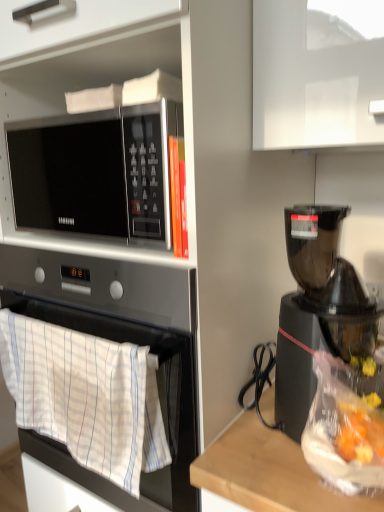
Question: Is black plastic coffee maker at right bigger than white cotton towel at lower left?

Choices:
 (A) yes
 (B) no

Answer: (A)

Question: Can you confirm if black plastic coffee maker at right is shorter than white cotton towel at lower left?

Choices:
 (A) no
 (B) yes

Answer: (A)

Question: Does black plastic coffee maker at right have a lesser width compared to white cotton towel at lower left?

Choices:
 (A) yes
 (B) no

Answer: (B)

Question: From the image's perspective, would you say black plastic coffee maker at right is shown under white cotton towel at lower left?

Choices:
 (A) yes
 (B) no

Answer: (B)

Question: Can you confirm if black plastic coffee maker at right is positioned to the left of white cotton towel at lower left?

Choices:
 (A) no
 (B) yes

Answer: (A)

Question: Is point (26, 252) closer or farther from the camera than point (39, 151)?

Choices:
 (A) closer
 (B) farther

Answer: (A)

Question: Is white cotton towel at lower left in front of or behind sleek silver microwave at upper left in the image?

Choices:
 (A) front
 (B) behind

Answer: (A)

Question: In terms of width, does white cotton towel at lower left look wider or thinner when compared to sleek silver microwave at upper left?

Choices:
 (A) wide
 (B) thin

Answer: (B)

Question: Is white cotton towel at lower left bigger or smaller than sleek silver microwave at upper left?

Choices:
 (A) small
 (B) big

Answer: (A)

Question: Would you say black plastic coffee maker at right is inside or outside white cotton towel at lower left?

Choices:
 (A) outside
 (B) inside

Answer: (A)

Question: From the image's perspective, relative to white cotton towel at lower left, is black plastic coffee maker at right above or below?

Choices:
 (A) above
 (B) below

Answer: (A)

Question: Is black plastic coffee maker at right bigger or smaller than white cotton towel at lower left?

Choices:
 (A) small
 (B) big

Answer: (B)

Question: Considering their positions, is black plastic coffee maker at right located in front of or behind white cotton towel at lower left?

Choices:
 (A) behind
 (B) front

Answer: (B)

Question: Considering the positions of white cotton towel at lower left and black plastic coffee maker at right in the image, is white cotton towel at lower left bigger or smaller than black plastic coffee maker at right?

Choices:
 (A) small
 (B) big

Answer: (A)

Question: Does point (36, 297) appear closer or farther from the camera than point (314, 241)?

Choices:
 (A) farther
 (B) closer

Answer: (B)